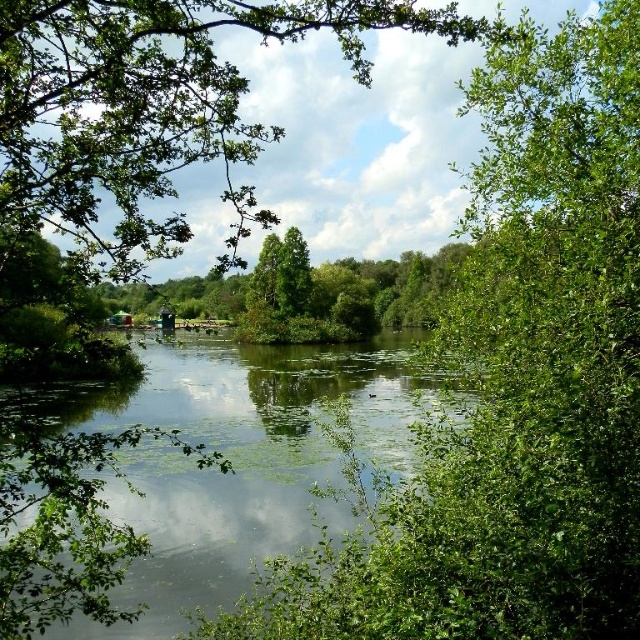
Between green leafy tree at upper center and green leafy tree at center, which one is positioned lower?

green leafy tree at upper center

Between green leafy tree at upper center and green leafy tree at center, which one appears on the right side from the viewer's perspective?

green leafy tree at center is more to the right.

Who is more forward, (179, 3) or (308, 324)?

Point (179, 3)

At what (x,y) coordinates should I click in order to perform the action: click on green leafy tree at upper center. Please return your answer as a coordinate pair (x, y). Looking at the image, I should click on (152, 108).

Is point (362, 419) closer to camera compared to point (282, 333)?

Yes, point (362, 419) is in front of point (282, 333).

Is the position of green leafy river at center more distant than that of green leafy tree at center?

That is False.

This screenshot has width=640, height=640. In order to click on green leafy river at center in this screenshot , I will do [232, 460].

Does green leafy tree at upper center appear under green leafy river at center?

No.

Does point (188, 157) lie behind point (160, 408)?

No, it is in front of (160, 408).

You are a GUI agent. You are given a task and a screenshot of the screen. Output one action in this format:
    pyautogui.click(x=<x>, y=<y>)
    Task: Click on the green leafy tree at upper center
    This screenshot has width=640, height=640.
    Given the screenshot: What is the action you would take?
    pyautogui.click(x=152, y=108)